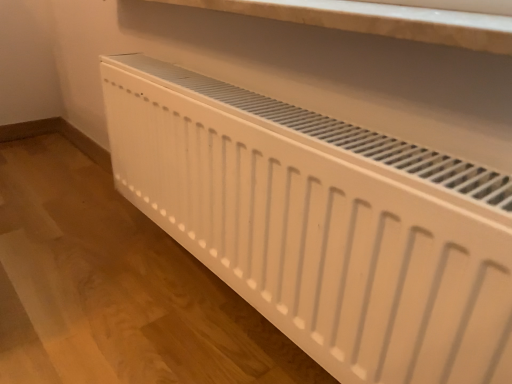
Question: Considering the relative sizes of white marble shelf at upper center and white matte radiator at lower center in the image provided, is white marble shelf at upper center wider than white matte radiator at lower center?

Choices:
 (A) yes
 (B) no

Answer: (A)

Question: Is white matte radiator at lower center completely or partially inside white marble shelf at upper center?

Choices:
 (A) no
 (B) yes

Answer: (A)

Question: From the image's perspective, does white marble shelf at upper center appear lower than white matte radiator at lower center?

Choices:
 (A) yes
 (B) no

Answer: (B)

Question: Is white marble shelf at upper center at the right side of white matte radiator at lower center?

Choices:
 (A) no
 (B) yes

Answer: (B)

Question: From the image's perspective, does white marble shelf at upper center appear higher than white matte radiator at lower center?

Choices:
 (A) yes
 (B) no

Answer: (A)

Question: Considering the relative sizes of white marble shelf at upper center and white matte radiator at lower center in the image provided, is white marble shelf at upper center smaller than white matte radiator at lower center?

Choices:
 (A) yes
 (B) no

Answer: (A)

Question: Does white matte radiator at lower center have a smaller size compared to white marble shelf at upper center?

Choices:
 (A) yes
 (B) no

Answer: (B)

Question: Is white matte radiator at lower center positioned with its back to white marble shelf at upper center?

Choices:
 (A) yes
 (B) no

Answer: (B)

Question: From the image's perspective, is white matte radiator at lower center above white marble shelf at upper center?

Choices:
 (A) yes
 (B) no

Answer: (B)

Question: Are white matte radiator at lower center and white marble shelf at upper center far apart?

Choices:
 (A) yes
 (B) no

Answer: (B)

Question: Is white matte radiator at lower center positioned in front of white marble shelf at upper center?

Choices:
 (A) no
 (B) yes

Answer: (B)

Question: Is white matte radiator at lower center wider than white marble shelf at upper center?

Choices:
 (A) yes
 (B) no

Answer: (B)

Question: From a real-world perspective, is white matte radiator at lower center positioned above or below white marble shelf at upper center?

Choices:
 (A) below
 (B) above

Answer: (A)